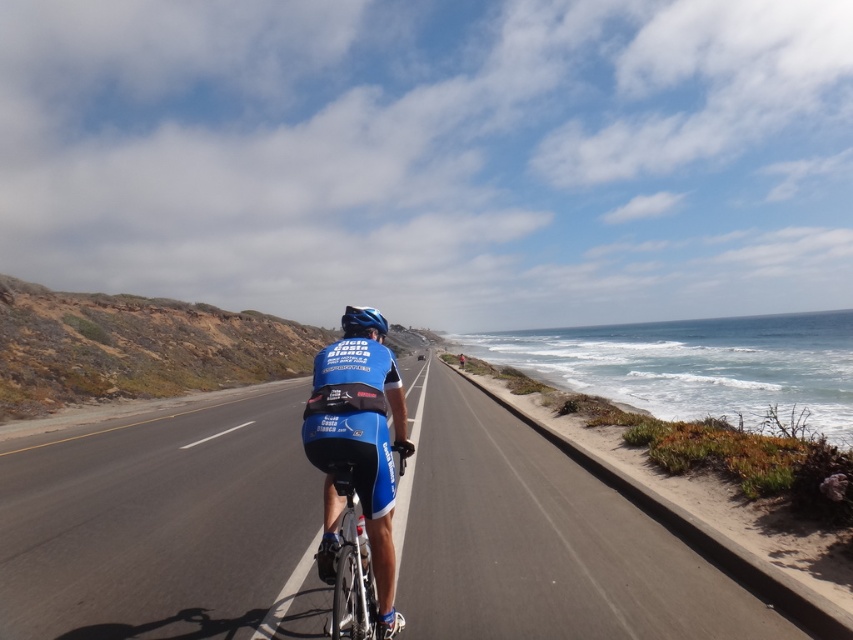
Consider the image. You are a photographer trying to capture the cyclist in the scene. You want to ensure that both the blue fabric jersey at center and the shiny metallic bicycle at center are clearly visible in your shot. Based on their sizes, which object should you focus on to ensure both are in frame?

The blue fabric jersey at center is taller than the shiny metallic bicycle at center, so focusing on the taller jersey will help ensure both are in frame.

You are a drone operator trying to capture a photo of the smooth asphalt road at center. Your drone is currently 3 meters away from the road. Do you need to adjust the drone to get a clear shot?

The smooth asphalt road at center is 3.59 meters from the camera. Since the drone is currently 3 meters away, it needs to move an additional 0.59 meters closer to the road to capture a clear shot.

You are a drone operator trying to capture the cyclist from above. You have two points marked on your screen to focus on. Point A is at coordinates point (390, 465) and Point B is at point (354, 637). Which point is closer to the camera?

Point B at point (354, 637) is closer to the camera than Point A at point (390, 465).